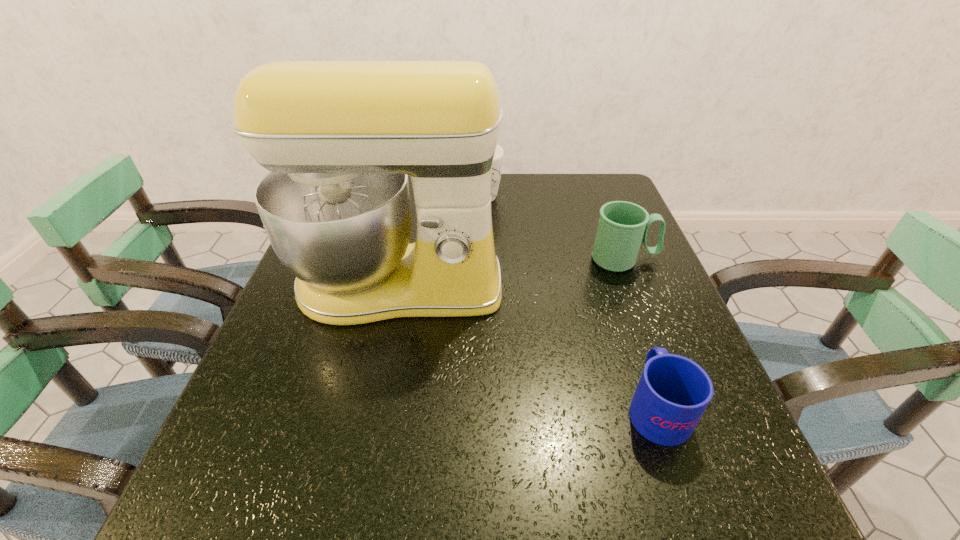
Identify the location of free location that satisfies the following two spatial constraints: 1. on the side of the farthest object with the handle; 2. on the side with the handle of the shortest mug. (469, 407).

Identify the location of vacant space that satisfies the following two spatial constraints: 1. on the side of the second farthest mug with the handle; 2. on the side of the tallest object with the control knob. (635, 286).

The width and height of the screenshot is (960, 540). Identify the location of blank space that satisfies the following two spatial constraints: 1. on the side of the farthest mug with the handle; 2. on the side of the mixer with the control knob. (472, 286).

The image size is (960, 540). In order to click on vacant position in the image that satisfies the following two spatial constraints: 1. on the side with the handle of the shortest mug; 2. on the side of the leftmost mug with the handle in this screenshot , I will do `click(585, 197)`.

Locate an element on the screen. Image resolution: width=960 pixels, height=540 pixels. vacant space that satisfies the following two spatial constraints: 1. on the side of the farthest object with the handle; 2. on the side of the tallest object with the control knob is located at coordinates (472, 286).

What are the coordinates of `vacant space that satisfies the following two spatial constraints: 1. on the side of the farthest object with the handle; 2. on the side with the handle of the shortest object` in the screenshot? It's located at (469, 407).

At what (x,y) coordinates should I click in order to perform the action: click on vacant space that satisfies the following two spatial constraints: 1. on the side of the farthest mug with the handle; 2. on the side with the handle of the shortest mug. Please return your answer as a coordinate pair (x, y). Looking at the image, I should click on (469, 407).